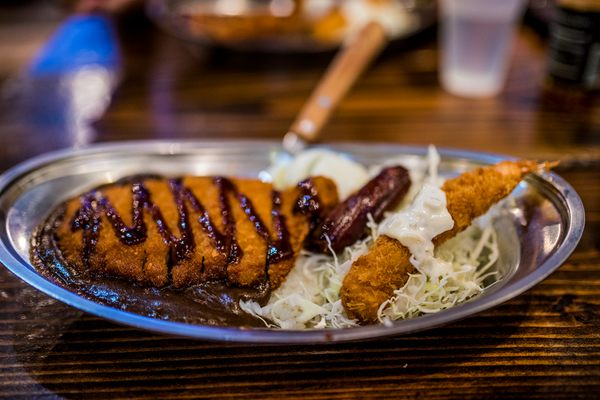
You are a GUI agent. You are given a task and a screenshot of the screen. Output one action in this format:
    pyautogui.click(x=<x>, y=<y>)
    Task: Click on the table
    This screenshot has height=400, width=600.
    Given the screenshot: What is the action you would take?
    pyautogui.click(x=357, y=361)